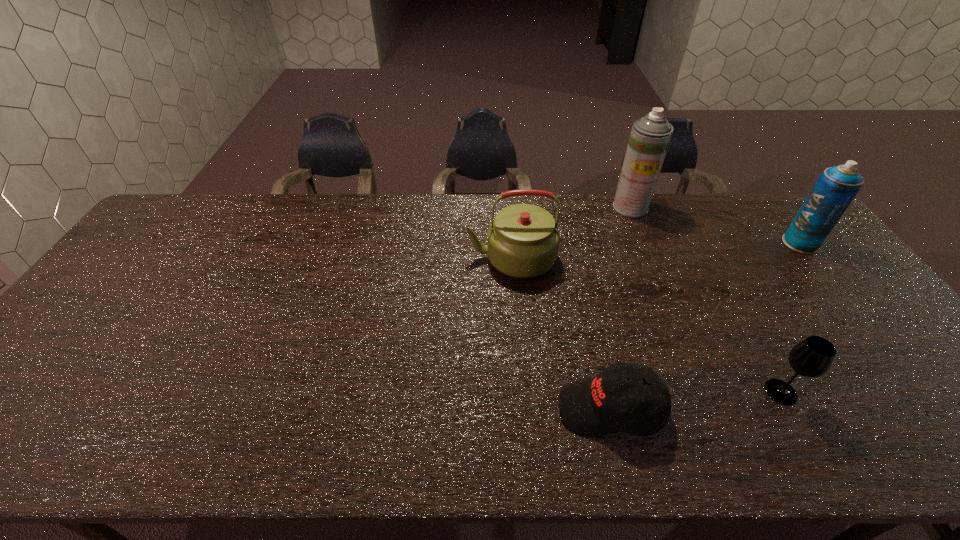
Find the location of a particular element. The width and height of the screenshot is (960, 540). the taller aerosol can is located at coordinates (650, 136).

Where is `the left aerosol can`? This screenshot has width=960, height=540. the left aerosol can is located at coordinates (650, 136).

This screenshot has width=960, height=540. Identify the location of the rightmost object. (835, 189).

At what (x,y) coordinates should I click in order to perform the action: click on the right aerosol can. Please return your answer as a coordinate pair (x, y). Image resolution: width=960 pixels, height=540 pixels. Looking at the image, I should click on (835, 189).

The height and width of the screenshot is (540, 960). Find the location of `kettle`. kettle is located at coordinates (523, 241).

The image size is (960, 540). I want to click on the fourth object from left to right, so click(x=812, y=357).

Where is `wineglass`? This screenshot has width=960, height=540. wineglass is located at coordinates (812, 357).

Where is `the shortest object`? the shortest object is located at coordinates (591, 407).

Image resolution: width=960 pixels, height=540 pixels. What are the coordinates of `vacant space situated 0.230m on the front of the left aerosol can` in the screenshot? It's located at (654, 265).

I want to click on free space located 0.140m on the back of the rightmost object, so click(772, 207).